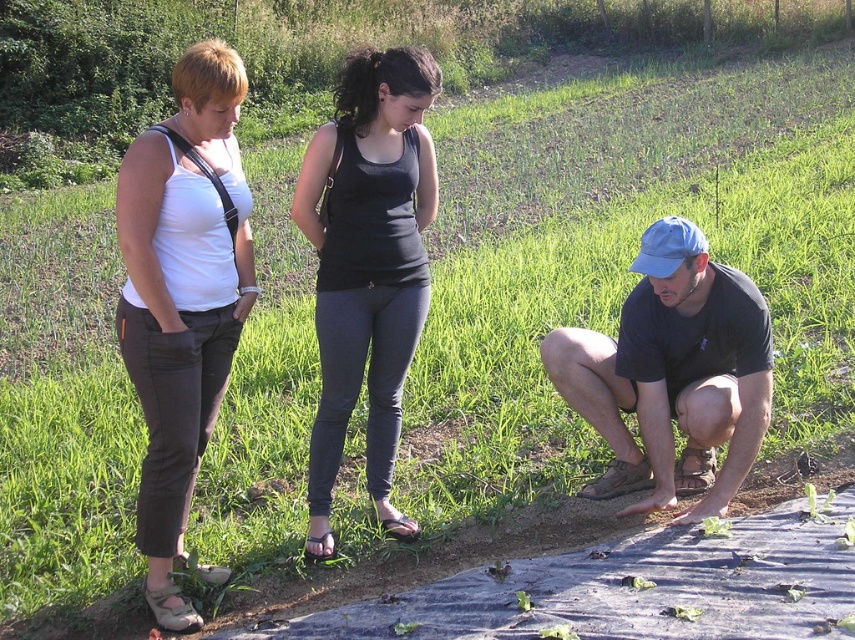
Who is lower down, matte white tank top at center or white matte tank top at left?

white matte tank top at left

This screenshot has width=855, height=640. In order to click on matte white tank top at center in this screenshot , I will do `click(181, 298)`.

Can you confirm if black matte tank top at center is positioned to the right of blue cap at lower right?

Incorrect, black matte tank top at center is not on the right side of blue cap at lower right.

Find the location of a particular element. black matte tank top at center is located at coordinates (369, 266).

Is point (149, 577) farther from camera compared to point (410, 332)?

That is False.

Who is lower down, white matte tank top at left or black matte tank top at center?

Positioned lower is white matte tank top at left.

Image resolution: width=855 pixels, height=640 pixels. In order to click on white matte tank top at left in this screenshot , I will do `click(181, 298)`.